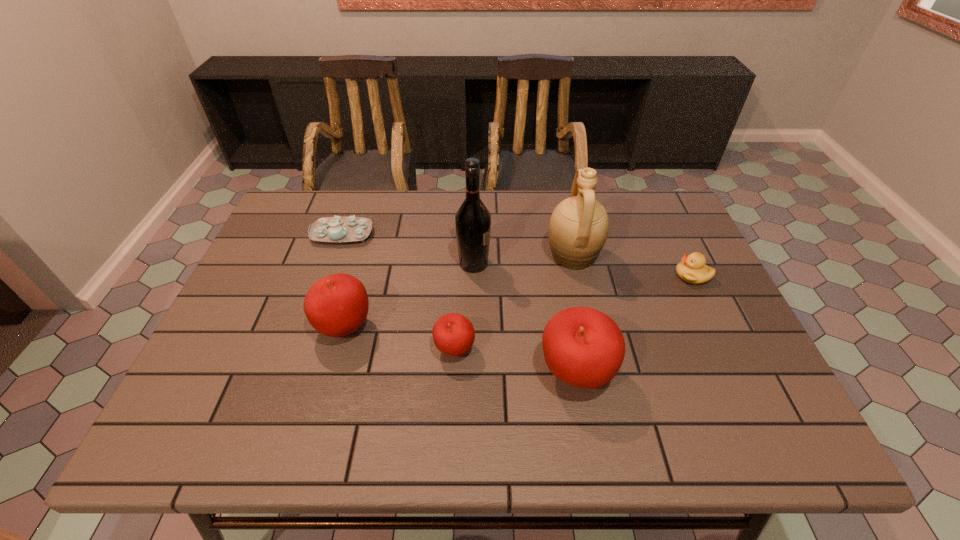
This screenshot has width=960, height=540. What are the coordinates of `object situated at the near edge` in the screenshot? It's located at (583, 347).

You are a GUI agent. You are given a task and a screenshot of the screen. Output one action in this format:
    pyautogui.click(x=<x>, y=<y>)
    Task: Click on the object present at the left edge
    The image size is (960, 540).
    Given the screenshot: What is the action you would take?
    pyautogui.click(x=331, y=229)

Where is `object that is at the right edge`? object that is at the right edge is located at coordinates (692, 269).

I want to click on object situated at the far left corner, so click(x=331, y=229).

Locate an element on the screen. vacant space at the far edge of the desktop is located at coordinates (464, 190).

Where is `vacant region at the near edge of the desktop`? vacant region at the near edge of the desktop is located at coordinates (623, 377).

Locate an element on the screen. vacant space at the left edge of the desktop is located at coordinates (288, 274).

I want to click on vacant region at the right edge, so click(663, 259).

At what (x,y) coordinates should I click in order to perform the action: click on vacant region at the near left corner of the desktop. Please return your answer as a coordinate pair (x, y). The width and height of the screenshot is (960, 540). Looking at the image, I should click on click(271, 368).

Where is `free space between the wine bottle and the leftmost apple`? This screenshot has width=960, height=540. free space between the wine bottle and the leftmost apple is located at coordinates (409, 295).